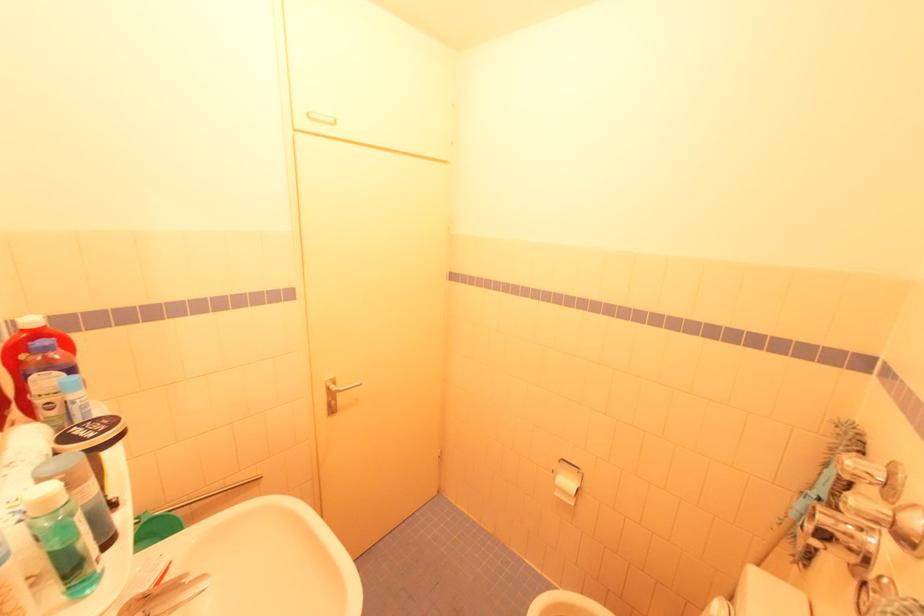
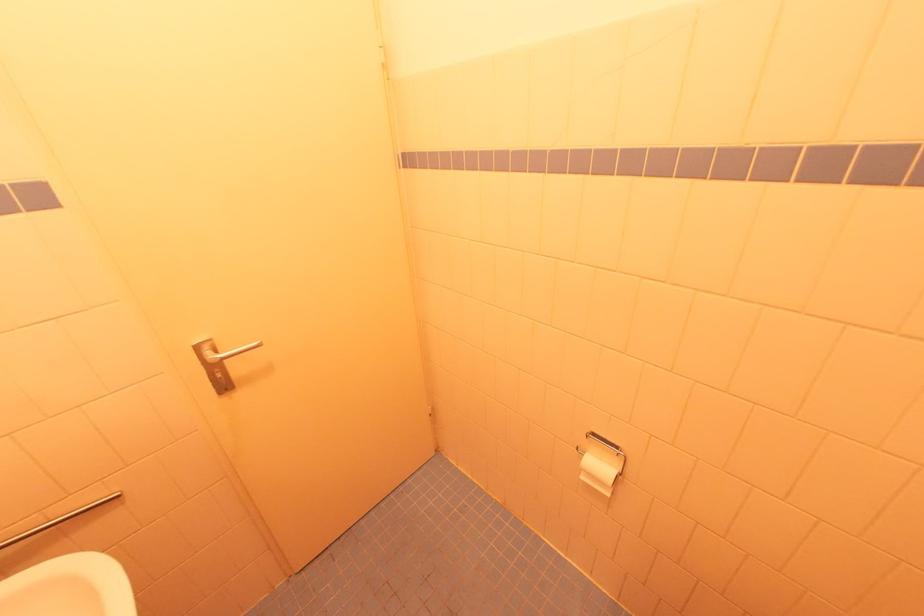
Where in the second image is the point corresponding to point (263, 477) from the first image?

(120, 495)